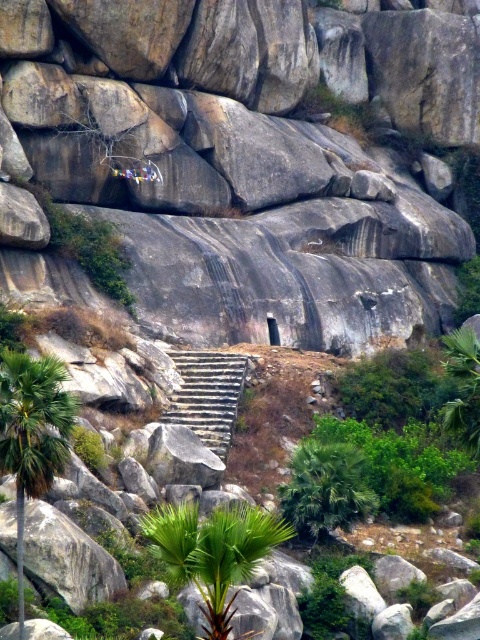
You are a hiker trying to reach the top of the slope. You see two green leafy palms in your path. The first is the green leafy palm at lower center and the second is the green leafy palm at center. Which palm should you pass first to stay on the correct path?

You should pass the green leafy palm at lower center first because it is in front of the green leafy palm at center, so it comes first along your path.

You are standing at the base of the slope and see the green leafy palm at lower center. What are the coordinates of the palm?

The green leafy palm at lower center is located at coordinates point (x=214, y=552).

You are a hiker trying to decide which palm tree to rest under. The green leafy palm at lower center and the green leafy palm tree at lower left are both options. Which one is taller?

The green leafy palm at lower center is taller than the green leafy palm tree at lower left.